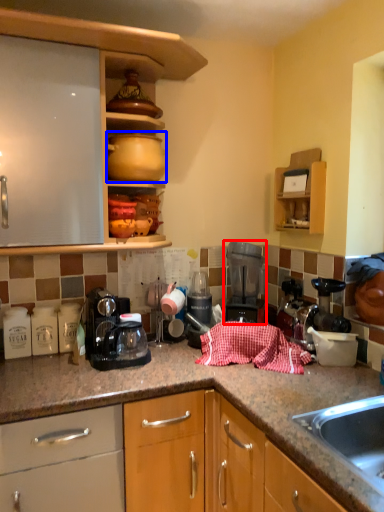
Question: Among these objects, which one is nearest to the camera, kitchen appliance (highlighted by a red box) or appliance (highlighted by a blue box)?

Choices:
 (A) kitchen appliance
 (B) appliance

Answer: (B)